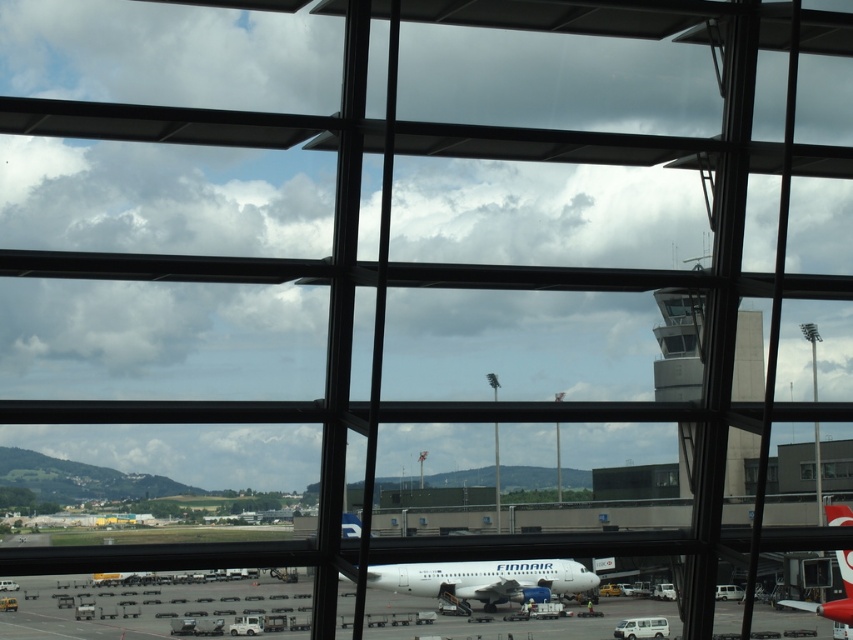
Question: Is white glossy airplane at center above white glossy airplane at lower right?

Choices:
 (A) yes
 (B) no

Answer: (B)

Question: Does white glossy airplane at center appear on the left side of concrete control tower at upper right?

Choices:
 (A) no
 (B) yes

Answer: (B)

Question: Estimate the real-world distances between objects in this image. Which object is closer to the concrete control tower at upper right?

Choices:
 (A) white glossy airplane at lower right
 (B) white matte airplane at center

Answer: (A)

Question: Is white matte airplane at center closer to the viewer compared to transparent glass window at center?

Choices:
 (A) yes
 (B) no

Answer: (A)

Question: Which of the following is the closest to the observer?

Choices:
 (A) white glossy airplane at center
 (B) transparent glass window at center
 (C) white matte airplane at center

Answer: (C)

Question: Which point appears farthest from the camera in this image?

Choices:
 (A) tap(843, 524)
 (B) tap(741, 310)
 (C) tap(271, 600)
 (D) tap(770, 472)

Answer: (B)